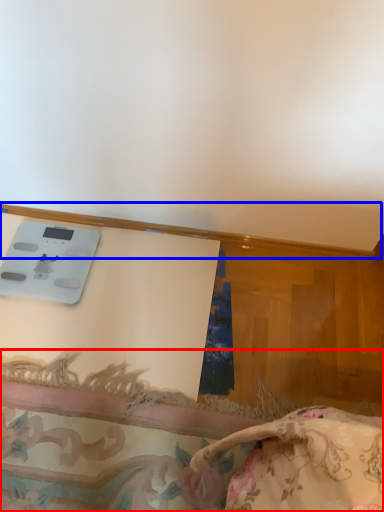
Question: Which of the following is the farthest to the observer, furniture (highlighted by a red box) or trim (highlighted by a blue box)?

Choices:
 (A) furniture
 (B) trim

Answer: (B)